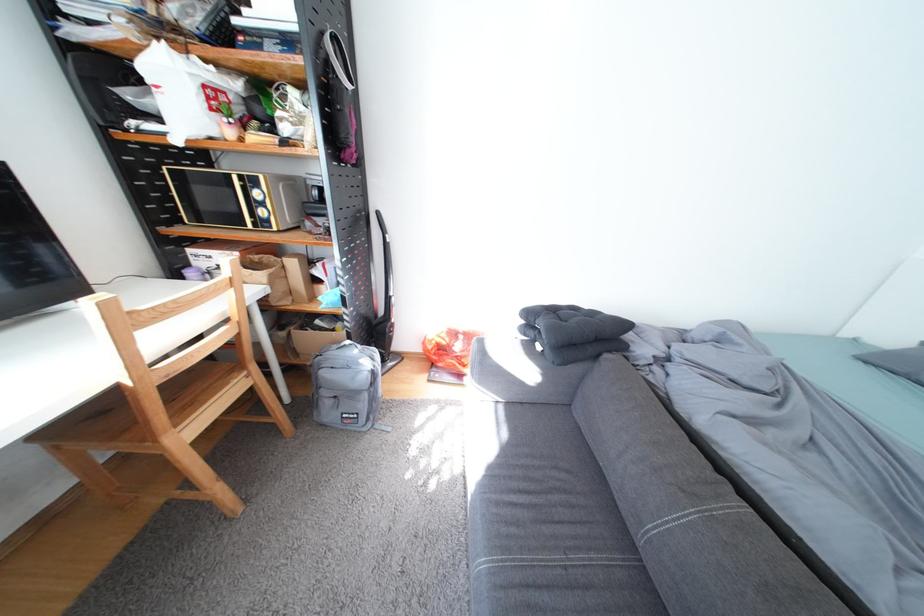
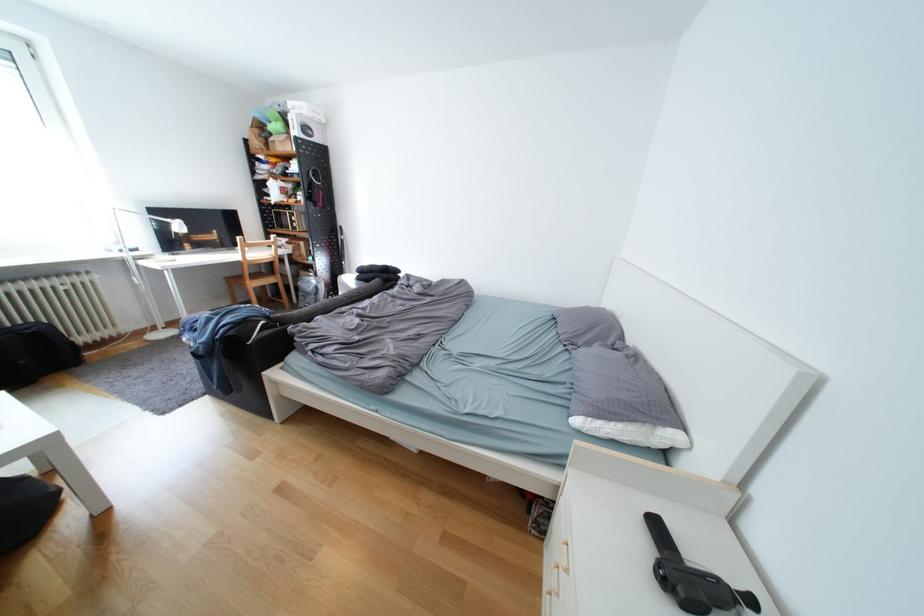
Find the pixel in the second image that matches point 200,434 in the first image.

(265, 285)